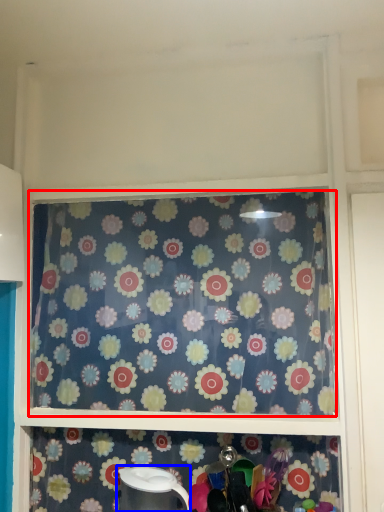
Question: Which point is further to the camera, curtain (highlighted by a red box) or appliance (highlighted by a blue box)?

Choices:
 (A) curtain
 (B) appliance

Answer: (A)